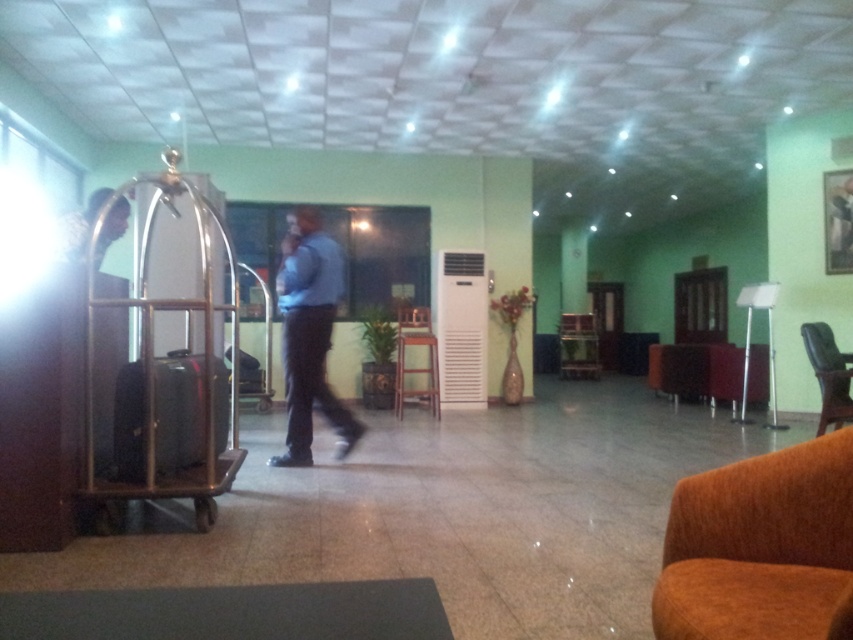
Question: Is blue shirt at center to the right of shiny black suitcase at left from the viewer's perspective?

Choices:
 (A) yes
 (B) no

Answer: (A)

Question: Which point appears farthest from the camera in this image?

Choices:
 (A) (x=276, y=461)
 (B) (x=827, y=358)
 (C) (x=695, y=611)

Answer: (B)

Question: Does shiny black suitcase at left appear under brown leather armchair at lower right?

Choices:
 (A) yes
 (B) no

Answer: (B)

Question: Which object is the farthest from the orange fabric armchair at lower right?

Choices:
 (A) blue shirt at center
 (B) light brown leather jacket at left
 (C) silver metallic luggage cart at left

Answer: (A)

Question: Does shiny black suitcase at left appear over brown fabric armchair at center?

Choices:
 (A) yes
 (B) no

Answer: (A)

Question: Among these points, which one is farthest from the camera?

Choices:
 (A) (837, 440)
 (B) (651, 344)
 (C) (289, 314)

Answer: (B)